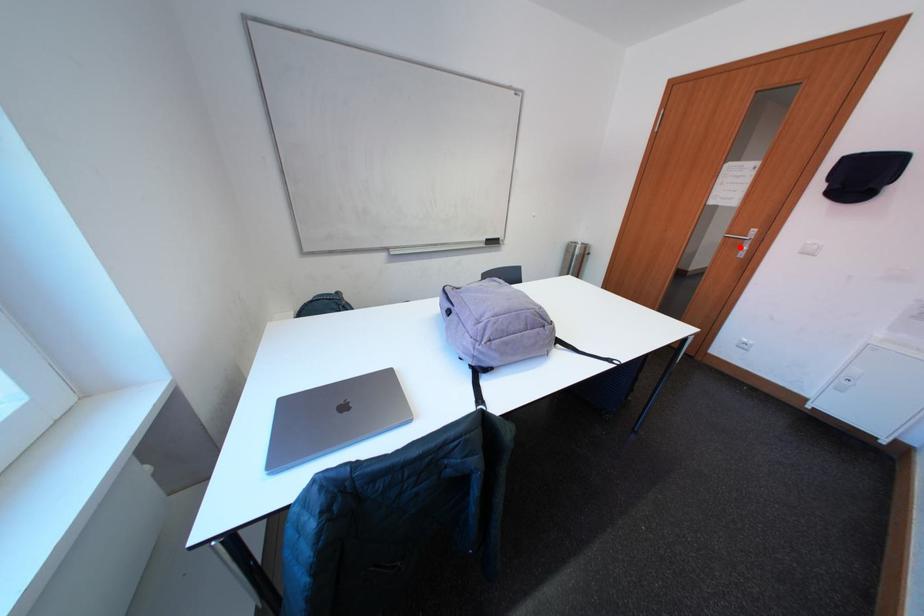
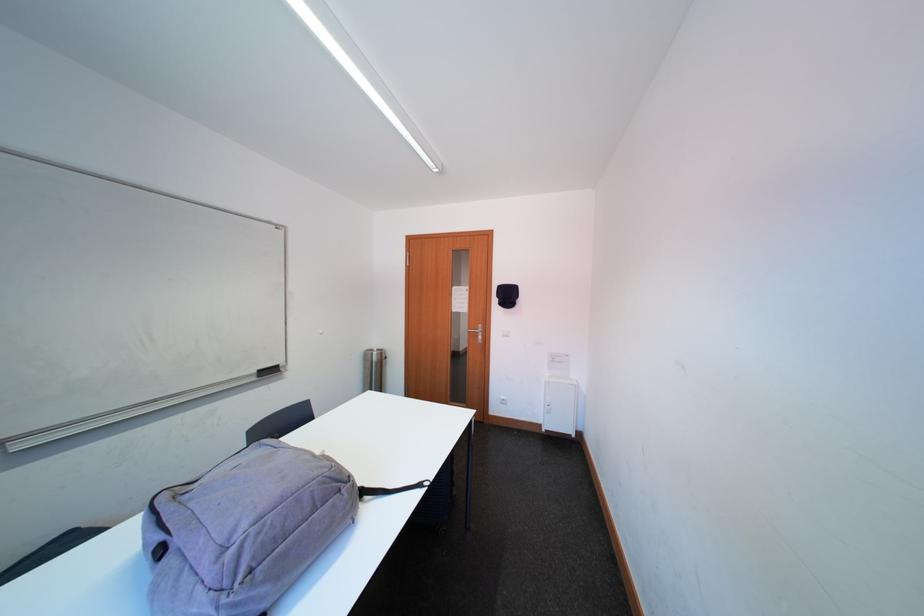
Find the pixel in the second image that matches the highlighted location in the first image.

(481, 339)